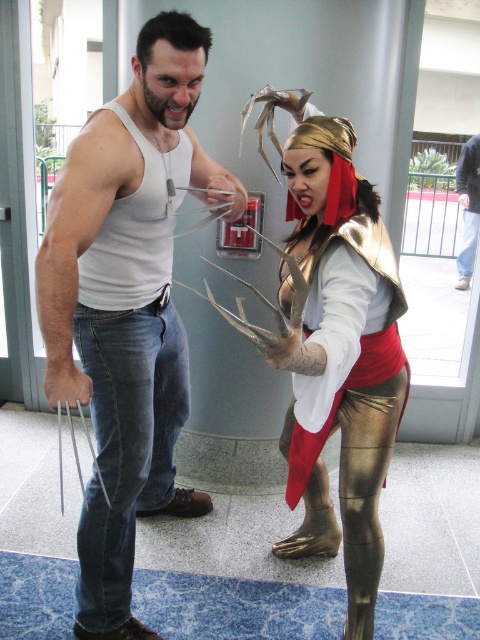
Question: Which is nearer to the gold metallic pants at lower center?

Choices:
 (A) matte white tank top at center
 (B) gold metallic costume at center

Answer: (B)

Question: Based on their relative distances, which object is nearer to the gold metallic pants at lower center?

Choices:
 (A) matte white tank top at center
 (B) gold metallic costume at center

Answer: (B)

Question: Is matte white tank top at center to the right of gold metallic costume at center from the viewer's perspective?

Choices:
 (A) yes
 (B) no

Answer: (B)

Question: From the image, what is the correct spatial relationship of matte white tank top at center in relation to gold metallic costume at center?

Choices:
 (A) below
 (B) above

Answer: (B)

Question: Is gold metallic costume at center closer to camera compared to gold metallic pants at lower center?

Choices:
 (A) yes
 (B) no

Answer: (A)

Question: Which point appears farthest from the camera in this image?

Choices:
 (A) (384, 483)
 (B) (345, 429)

Answer: (A)